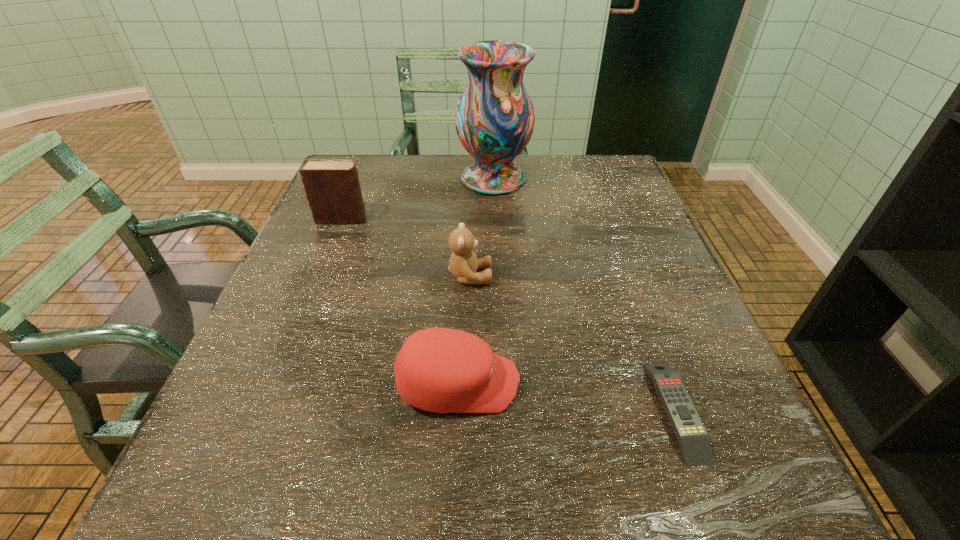
Identify the location of vacant space that satisfies the following two spatial constraints: 1. on the face of the rightmost object; 2. on the left side of the third shortest object. point(467,410).

I want to click on vacant space that satisfies the following two spatial constraints: 1. on the front-facing side of the fourth tallest object; 2. on the right side of the remote control, so click(x=457, y=410).

Find the location of a particular element. The height and width of the screenshot is (540, 960). vacant space that satisfies the following two spatial constraints: 1. on the back side of the shortest object; 2. on the front-facing side of the fourth tallest object is located at coordinates (665, 383).

Find the location of a particular element. The height and width of the screenshot is (540, 960). vacant area that satisfies the following two spatial constraints: 1. on the spine side of the shortest object; 2. on the right side of the fourth shortest object is located at coordinates (264, 410).